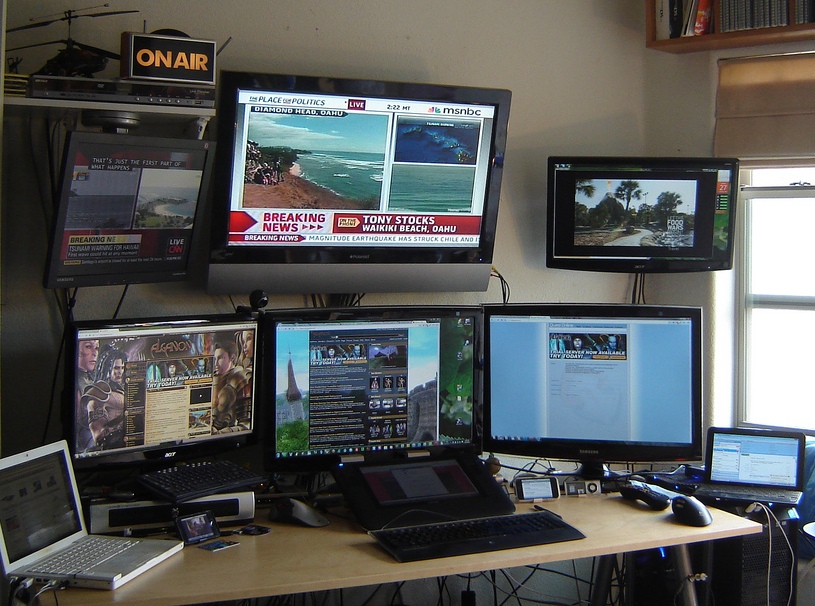
Image resolution: width=815 pixels, height=606 pixels. In order to click on window shade in this screenshot , I will do `click(778, 117)`.